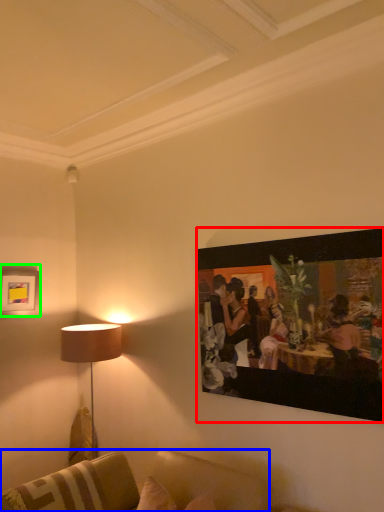
Question: Which is farther away from picture frame (highlighted by a red box)? studio couch (highlighted by a blue box) or picture frame (highlighted by a green box)?

Choices:
 (A) studio couch
 (B) picture frame

Answer: (B)